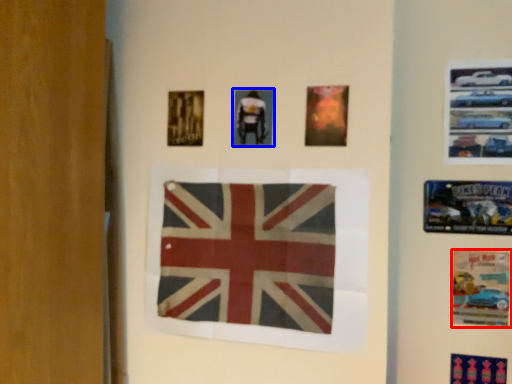
Question: Which object appears closest to the camera in this image, poster (highlighted by a red box) or poster (highlighted by a blue box)?

Choices:
 (A) poster
 (B) poster

Answer: (B)